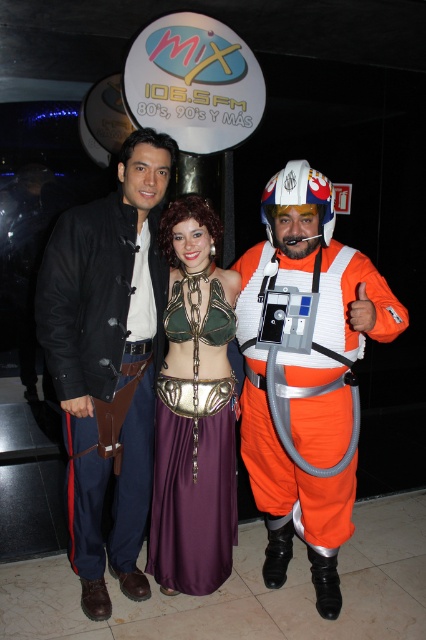
Between point (265, 396) and point (207, 484), which one is positioned behind?

Point (265, 396)

Looking at this image, between orange fabric spacesuit at center and metallic green armor at center, which one appears on the left side from the viewer's perspective?

Positioned to the left is metallic green armor at center.

Find the location of a particular element. The width and height of the screenshot is (426, 640). orange fabric spacesuit at center is located at coordinates (305, 372).

Does orange fabric spacesuit at center have a greater height compared to black leather jacket at center?

Incorrect, orange fabric spacesuit at center's height is not larger of black leather jacket at center's.

Is point (285, 384) positioned before point (124, 403)?

Yes, it is.

Between point (339, 436) and point (127, 179), which one is positioned behind?

Point (339, 436)

Where is `orange fabric spacesuit at center`? The image size is (426, 640). orange fabric spacesuit at center is located at coordinates (305, 372).

Describe the element at coordinates (299, 502) in the screenshot. I see `metallic chainmail bikini top at center` at that location.

Measure the distance between metallic chainmail bikini top at center and black leather jacket at center.

8.21 inches

Is point (261, 429) farther from viewer compared to point (154, 291)?

Yes, it is behind point (154, 291).

The height and width of the screenshot is (640, 426). Identify the location of metallic chainmail bikini top at center. (299, 502).